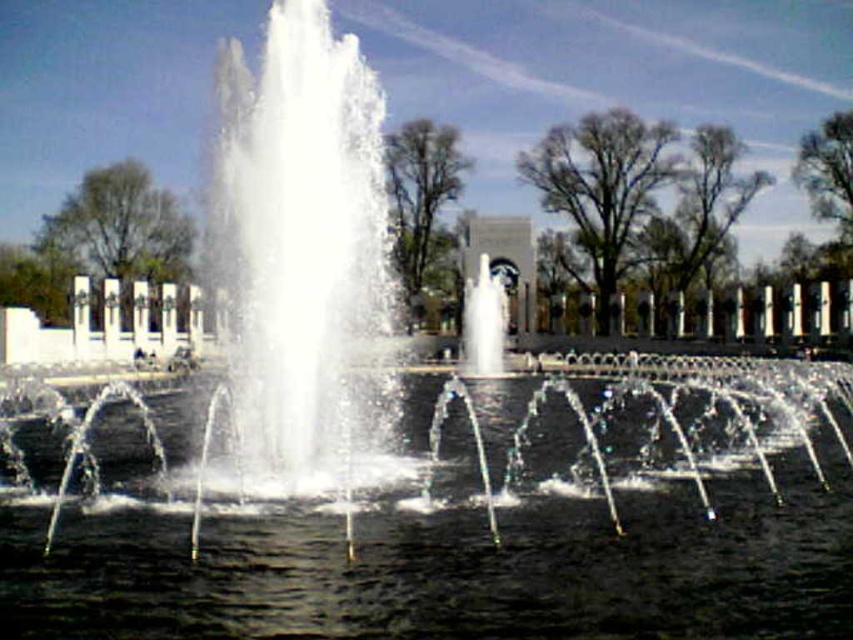
You are planning to place a small statue in the center of the fountain. Based on the scene, can the statue be placed in the clear water at center without touching the white marble fountain at center?

The clear water at center is wider than the white marble fountain at center, so yes, the statue can be placed in the clear water at center without touching the white marble fountain at center.

You are standing at the central fountain and want to take a photo of both point (294,634) and point (503,304). Which point will appear larger in your photo?

Point (294,634) is closer to the camera than point (503,304), so it will appear larger in the photo.